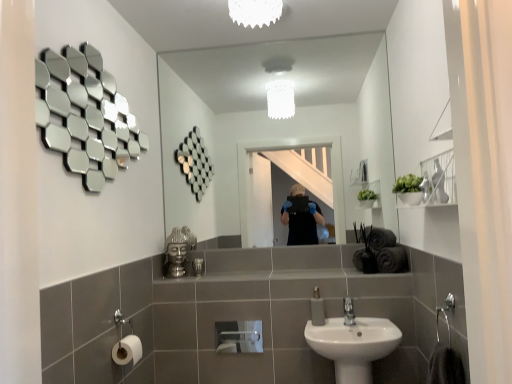
You are a GUI agent. You are given a task and a screenshot of the screen. Output one action in this format:
    pyautogui.click(x=<x>, y=<y>)
    Task: Click on the free space above shiny metallic hexagons at upper left, which is the 1th mirror in left-to-right order (from a real-world perspective)
    The height and width of the screenshot is (384, 512).
    Given the screenshot: What is the action you would take?
    (x=96, y=38)